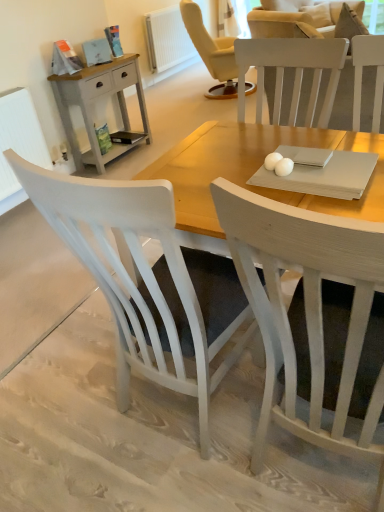
Question: Is white textured radiator at left, which is the first radiator in front-to-back order, completely or partially outside of white painted radiator at upper center, which is counted as the second radiator, starting from the bottom?

Choices:
 (A) no
 (B) yes

Answer: (B)

Question: Is the depth of white textured radiator at left, the 2th radiator from the top, greater than that of white painted radiator at upper center, which is the second radiator from left to right?

Choices:
 (A) no
 (B) yes

Answer: (A)

Question: Considering the relative sizes of white textured radiator at left, the 2th radiator when ordered from right to left, and white painted radiator at upper center, the 1th radiator in the top-to-bottom sequence, in the image provided, is white textured radiator at left, the 2th radiator when ordered from right to left, smaller than white painted radiator at upper center, the 1th radiator in the top-to-bottom sequence,?

Choices:
 (A) yes
 (B) no

Answer: (A)

Question: From a real-world perspective, is white textured radiator at left, the second radiator in the back-to-front sequence, beneath white painted radiator at upper center, the 1th radiator in the top-to-bottom sequence?

Choices:
 (A) no
 (B) yes

Answer: (A)

Question: Is white textured radiator at left, the 2th radiator when ordered from right to left, oriented away from white painted radiator at upper center, the 1th radiator in the top-to-bottom sequence?

Choices:
 (A) no
 (B) yes

Answer: (A)

Question: Can you confirm if white textured radiator at left, the second radiator in the back-to-front sequence, is thinner than white painted radiator at upper center, the 2th radiator viewed from the front?

Choices:
 (A) no
 (B) yes

Answer: (B)

Question: Considering the relative sizes of white wood chair at center, positioned as the first chair in left-to-right order, and white painted radiator at upper center, which is counted as the second radiator, starting from the bottom, in the image provided, is white wood chair at center, positioned as the first chair in left-to-right order, bigger than white painted radiator at upper center, which is counted as the second radiator, starting from the bottom,?

Choices:
 (A) no
 (B) yes

Answer: (B)

Question: From a real-world perspective, is white wood chair at center, positioned as the first chair in left-to-right order, on white painted radiator at upper center, the first radiator from the right?

Choices:
 (A) yes
 (B) no

Answer: (A)

Question: Is white wood chair at center, positioned as the first chair in left-to-right order, wider than white painted radiator at upper center, the 1th radiator in the top-to-bottom sequence?

Choices:
 (A) yes
 (B) no

Answer: (A)

Question: Is there a large distance between white wood chair at center, which is the 2th chair in right-to-left order, and white painted radiator at upper center, which is the second radiator from left to right?

Choices:
 (A) no
 (B) yes

Answer: (B)

Question: From a real-world perspective, is white wood chair at center, positioned as the first chair in left-to-right order, physically below white painted radiator at upper center, which is counted as the second radiator, starting from the bottom?

Choices:
 (A) no
 (B) yes

Answer: (A)

Question: Can you confirm if white wood chair at center, which is the 2th chair in right-to-left order, is taller than white painted radiator at upper center, the 2th radiator viewed from the front?

Choices:
 (A) yes
 (B) no

Answer: (A)

Question: Is matte gray wooden nightstand at left positioned before white painted radiator at upper center, the 1th radiator in the top-to-bottom sequence?

Choices:
 (A) yes
 (B) no

Answer: (A)